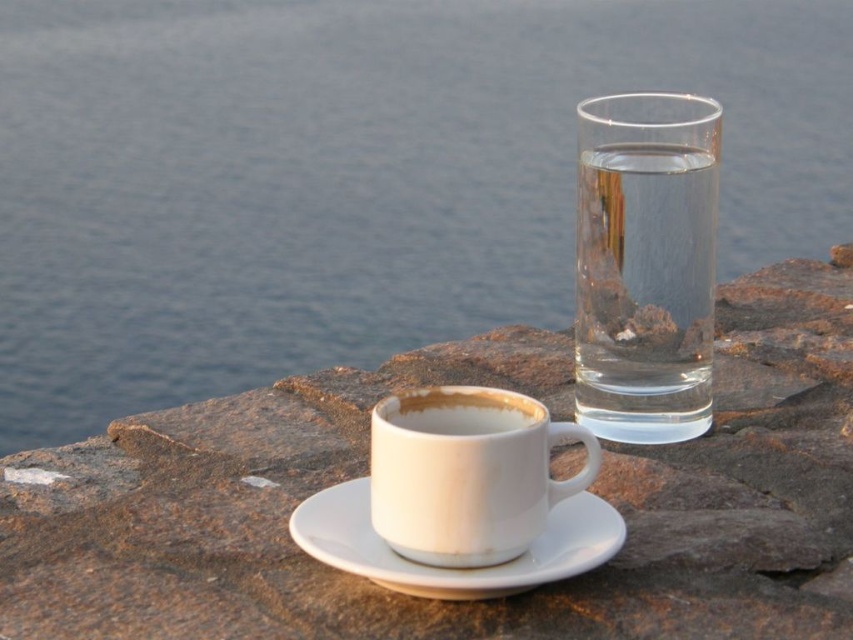
You are a photographer setting up a shot of the transparent glass water at right and the white matte cup at center. To ensure both are in frame, should you adjust your camera to the left or right?

Since the transparent glass water at right is to the right of the white matte cup at center, you should adjust your camera to the left to include both objects in the frame.

You are a delivery robot with a 4 inch wide arm. You need to place a small package between the transparent glass water at upper right and the white ceramic mug at center. Can your arm fit between them?

The transparent glass water at upper right and white ceramic mug at center are 5.44 inches apart, so yes, the robot arm which is 4 inches wide can fit between them.